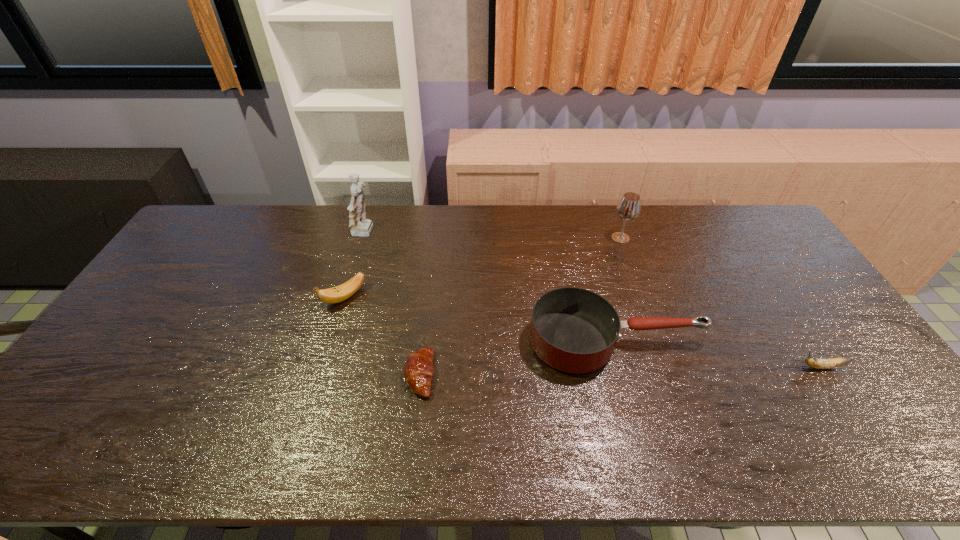
What are the coordinates of `figurine` in the screenshot? It's located at (360, 226).

Identify the location of wineglass. (629, 207).

The width and height of the screenshot is (960, 540). Find the location of `pan`. pan is located at coordinates (574, 330).

Identify the location of the taller banana. (342, 292).

Where is `the farther banana`? This screenshot has width=960, height=540. the farther banana is located at coordinates (342, 292).

Find the location of `the shorter banana`. the shorter banana is located at coordinates (837, 362).

Locate an element on the screen. the fifth tallest object is located at coordinates (837, 362).

Locate an element on the screen. This screenshot has height=540, width=960. the third object from left to right is located at coordinates (418, 370).

In order to click on the shortest object in this screenshot , I will do `click(418, 370)`.

Where is `free region located on the front-facing side of the tallest object`? The image size is (960, 540). free region located on the front-facing side of the tallest object is located at coordinates (396, 233).